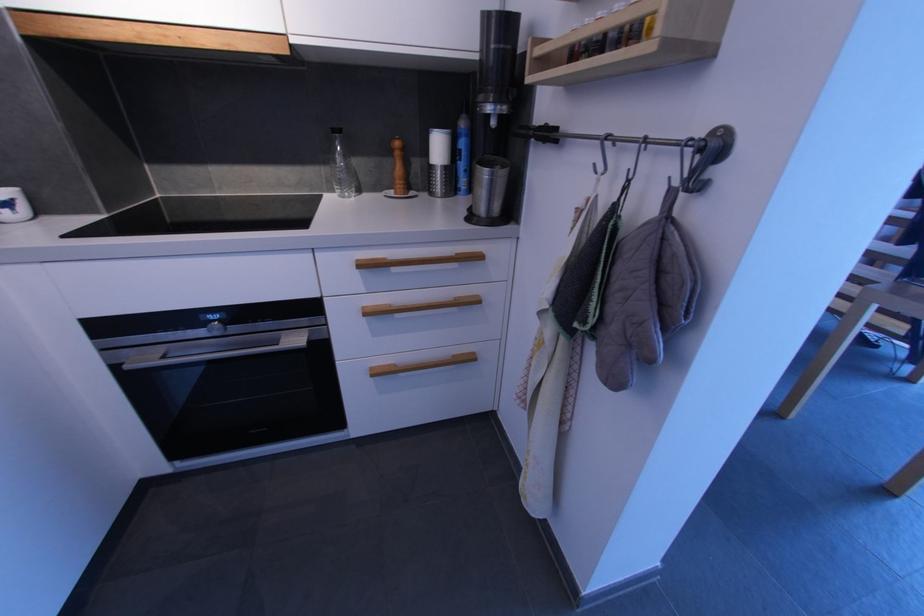
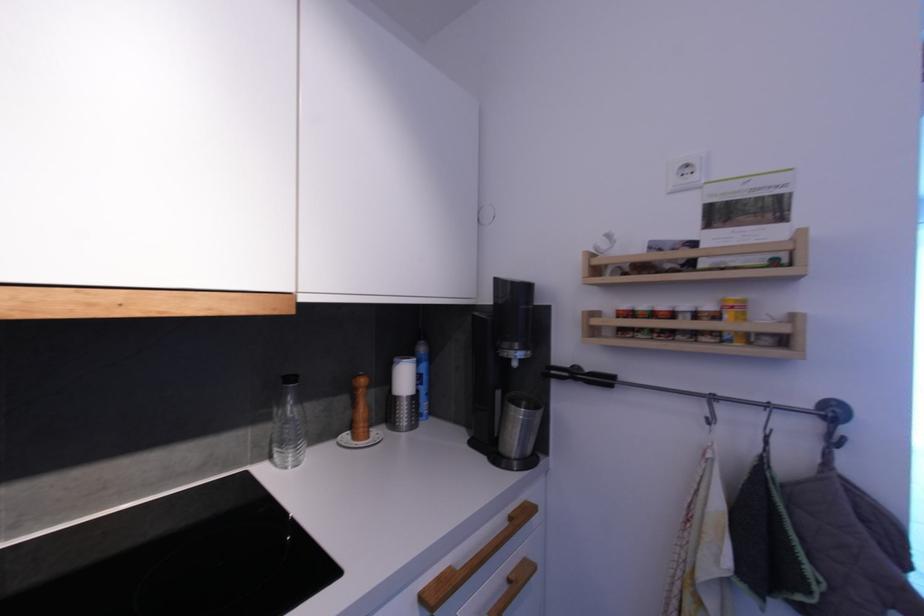
Locate, in the second image, the point that corresponds to point 460,257 in the first image.

(516, 519)